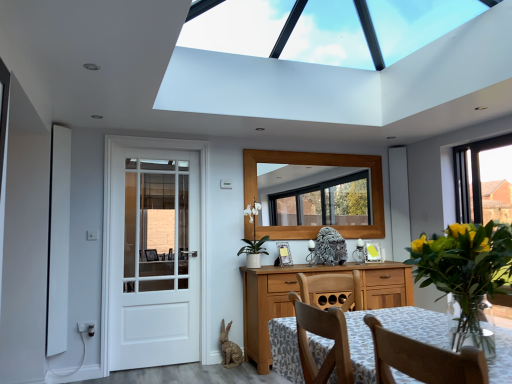
The height and width of the screenshot is (384, 512). Describe the element at coordinates (323, 165) in the screenshot. I see `wooden frame mirror at center` at that location.

What do you see at coordinates (298, 293) in the screenshot?
I see `wooden cabinet at center` at bounding box center [298, 293].

The image size is (512, 384). I want to click on white painted wood door at left, so click(x=157, y=252).

What do you see at coordinates (157, 252) in the screenshot?
I see `white painted wood door at left` at bounding box center [157, 252].

Describe the element at coordinates (466, 274) in the screenshot. The height and width of the screenshot is (384, 512). I see `translucent glass vase at right` at that location.

The height and width of the screenshot is (384, 512). I want to click on translucent glass vase at right, so click(466, 274).

Image resolution: width=512 pixels, height=384 pixels. In order to click on wooden frame mirror at center in this screenshot , I will do `click(323, 165)`.

Is white painted wood door at left at the back of translucent glass vase at right?

No, translucent glass vase at right is not facing the opposite direction of white painted wood door at left.

Which is in front, translucent glass vase at right or white painted wood door at left?

Positioned in front is translucent glass vase at right.

From a real-world perspective, is translucent glass vase at right physically located above or below white painted wood door at left?

In terms of real-world spatial position, translucent glass vase at right is below white painted wood door at left.

How different are the orientations of translucent glass vase at right and white painted wood door at left in degrees?

translucent glass vase at right and white painted wood door at left are facing 178 degrees away from each other.

Can you confirm if translucent glass vase at right is shorter than wooden cabinet at center?

No, translucent glass vase at right is not shorter than wooden cabinet at center.

Image resolution: width=512 pixels, height=384 pixels. I want to click on chest of drawers behind the translucent glass vase at right, so click(298, 293).

Consider the image. Considering the sizes of objects translucent glass vase at right and wooden cabinet at center in the image provided, who is thinner, translucent glass vase at right or wooden cabinet at center?

With smaller width is translucent glass vase at right.

Could you tell me if translucent glass vase at right is facing wooden cabinet at center?

Yes, translucent glass vase at right faces towards wooden cabinet at center.

Is translucent glass vase at right at the back of wooden frame mirror at center?

wooden frame mirror at center does not have its back to translucent glass vase at right.

You are a GUI agent. You are given a task and a screenshot of the screen. Output one action in this format:
    pyautogui.click(x=<x>, y=<y>)
    Task: Click on the window that appears above the translucent glass vase at right (from a real-world perspective)
    This screenshot has height=384, width=512.
    Given the screenshot: What is the action you would take?
    pyautogui.click(x=323, y=165)

From a real-world perspective, which is physically below, wooden frame mirror at center or translucent glass vase at right?

translucent glass vase at right is physically lower.

Considering the relative sizes of wooden frame mirror at center and wooden table at center in the image provided, is wooden frame mirror at center bigger than wooden table at center?

No, wooden frame mirror at center is not bigger than wooden table at center.

Considering the points (382, 237) and (370, 376), which point is behind, point (382, 237) or point (370, 376)?

The point (382, 237) is farther from the camera.

Considering the sizes of wooden frame mirror at center and wooden table at center in the image, is wooden frame mirror at center taller or shorter than wooden table at center?

In the image, wooden frame mirror at center appears to be taller than wooden table at center.

From a real-world perspective, which is physically below, wooden frame mirror at center or wooden table at center?

wooden table at center is physically lower.

Which of these two, wooden table at center or white painted wood door at left, stands shorter?

wooden table at center is shorter.

Between wooden table at center and white painted wood door at left, which one appears on the right side from the viewer's perspective?

wooden table at center.

Which is correct: wooden table at center is inside white painted wood door at left, or outside of it?

wooden table at center is spatially situated outside white painted wood door at left.

From the image's perspective, between white painted wood door at left and wooden cabinet at center, which one is located above?

white painted wood door at left, from the image's perspective.

From a real-world perspective, does white painted wood door at left stand above wooden cabinet at center?

Yes.

Is white painted wood door at left wider or thinner than wooden cabinet at center?

Clearly, white painted wood door at left has less width compared to wooden cabinet at center.

Which is more to the left, wooden table at center or wooden frame mirror at center?

wooden table at center.

How different are the orientations of wooden table at center and wooden frame mirror at center in degrees?

90.1 degrees.

Are wooden table at center and wooden frame mirror at center far apart?

wooden table at center is positioned a significant distance from wooden frame mirror at center.

From the image's perspective, does wooden table at center appear lower than wooden frame mirror at center?

Yes, from the image's perspective, wooden table at center is below wooden frame mirror at center.

Locate an element on the screen. Image resolution: width=512 pixels, height=384 pixels. door above the translucent glass vase at right (from a real-world perspective) is located at coordinates (157, 252).

I want to click on chest of drawers below the translucent glass vase at right (from a real-world perspective), so click(x=298, y=293).

Based on their spatial positions, is translucent glass vase at right or wooden table at center further from wooden frame mirror at center?

The object further to wooden frame mirror at center is translucent glass vase at right.

Considering their positions, is white painted wood door at left positioned closer to wooden cabinet at center than translucent glass vase at right?

white painted wood door at left.

Looking at the image, which one is located further to wooden frame mirror at center, wooden table at center or white painted wood door at left?

Among the two, wooden table at center is located further to wooden frame mirror at center.

Which object lies further to the anchor point translucent glass vase at right, white painted wood door at left or wooden cabinet at center?

The object further to translucent glass vase at right is white painted wood door at left.

Looking at the image, which one is located closer to wooden frame mirror at center, translucent glass vase at right or white painted wood door at left?

Based on the image, white painted wood door at left appears to be nearer to wooden frame mirror at center.

Estimate the real-world distances between objects in this image. Which object is further from wooden table at center, white painted wood door at left or translucent glass vase at right?

white painted wood door at left lies further to wooden table at center than the other object.

Looking at this image, looking at the image, which one is located further to wooden frame mirror at center, white painted wood door at left or wooden table at center?

wooden table at center lies further to wooden frame mirror at center than the other object.

When comparing their distances from white painted wood door at left, does wooden table at center or translucent glass vase at right seem further?

translucent glass vase at right is further to white painted wood door at left.

Where is `chest of drawers between wooden table at center and white painted wood door at left in the front-back direction`? chest of drawers between wooden table at center and white painted wood door at left in the front-back direction is located at coordinates (298, 293).

The image size is (512, 384). I want to click on chest of drawers between translucent glass vase at right and wooden frame mirror at center from front to back, so click(298, 293).

What are the coordinates of `door positioned between translucent glass vase at right and wooden frame mirror at center from near to far` in the screenshot? It's located at (157, 252).

Image resolution: width=512 pixels, height=384 pixels. I want to click on door located between wooden cabinet at center and wooden frame mirror at center in the depth direction, so click(157, 252).